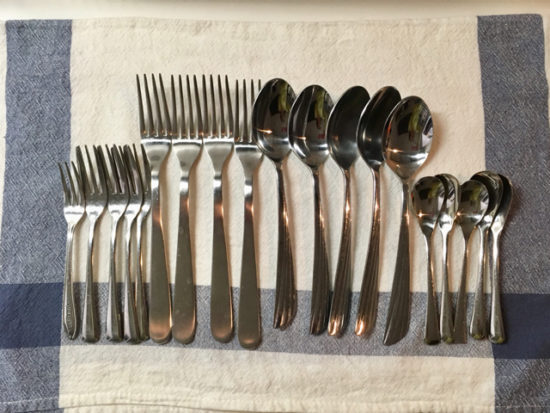
Find the location of a particular element. This screenshot has width=550, height=413. smaller forks is located at coordinates (71, 212), (91, 208), (114, 208), (133, 208), (145, 202).